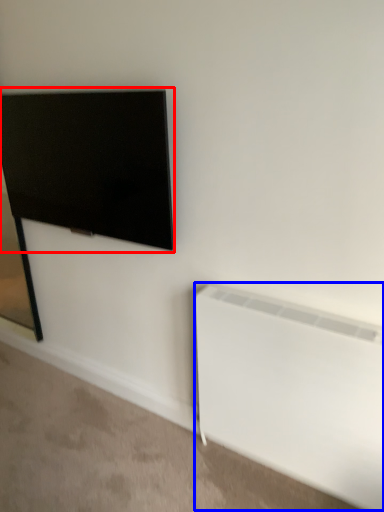
Question: Which of the following is the closest to the observer, television (highlighted by a red box) or radiator (highlighted by a blue box)?

Choices:
 (A) television
 (B) radiator

Answer: (B)